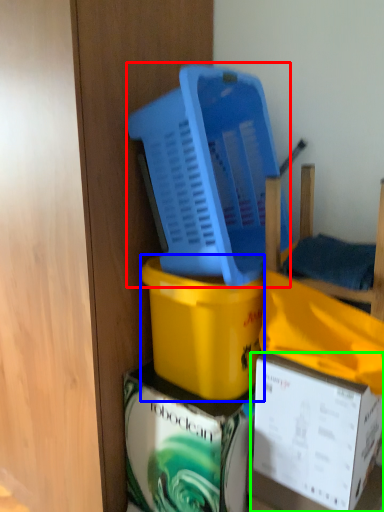
Question: Considering the real-world distances, which object is closest to basket (highlighted by a red box)? box (highlighted by a blue box) or box (highlighted by a green box).

Choices:
 (A) box
 (B) box

Answer: (A)